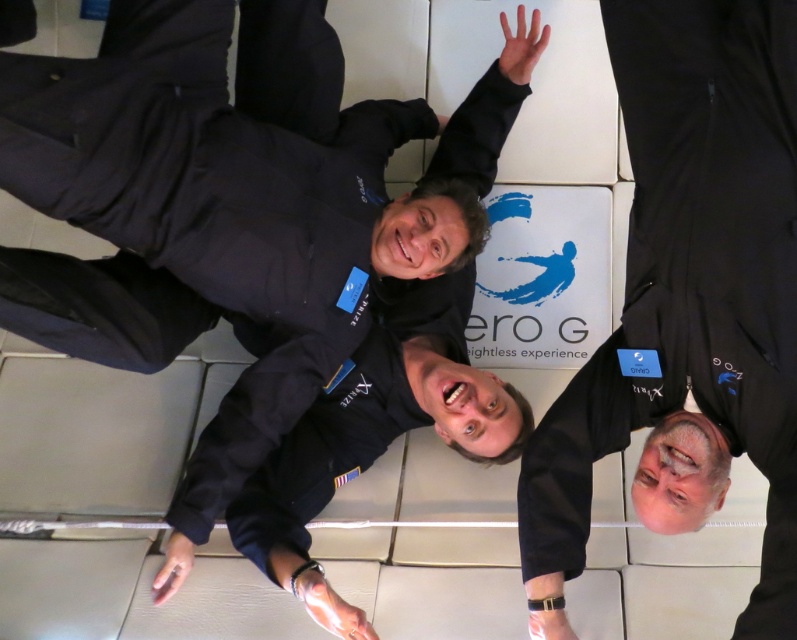
Between matte black suit at upper center and black matte jumpsuit at upper right, which one has more height?

With more height is matte black suit at upper center.

Which is in front, point (173, 506) or point (756, 442)?

Positioned in front is point (756, 442).

This screenshot has width=797, height=640. Find the location of `matte black suit at upper center`. matte black suit at upper center is located at coordinates (256, 234).

Image resolution: width=797 pixels, height=640 pixels. In order to click on matte black suit at upper center in this screenshot , I will do `click(256, 234)`.